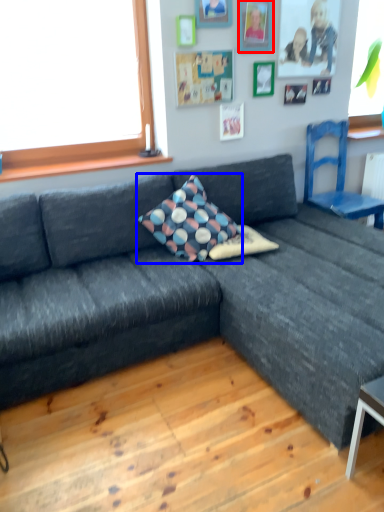
Question: Which point is further to the camera, picture frame (highlighted by a red box) or pillow (highlighted by a blue box)?

Choices:
 (A) picture frame
 (B) pillow

Answer: (A)